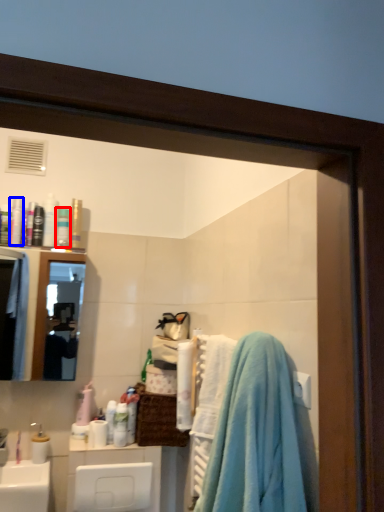
Question: Among these objects, which one is nearest to the camera, toiletry (highlighted by a red box) or toiletry (highlighted by a blue box)?

Choices:
 (A) toiletry
 (B) toiletry

Answer: (B)